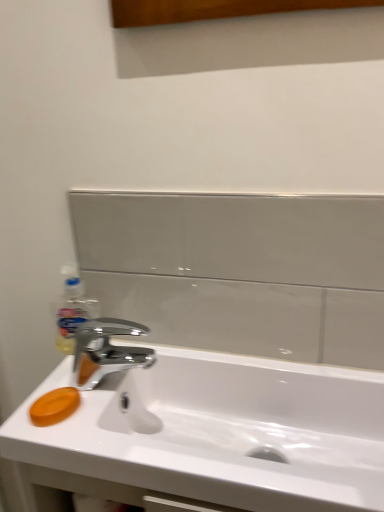
Question: From the image's perspective, does translucent plastic soap dispenser at left appear lower than chrome metallic faucet at center?

Choices:
 (A) yes
 (B) no

Answer: (B)

Question: Does translucent plastic soap dispenser at left appear on the right side of chrome metallic faucet at center?

Choices:
 (A) yes
 (B) no

Answer: (B)

Question: Considering the relative sizes of translucent plastic soap dispenser at left and chrome metallic faucet at center in the image provided, is translucent plastic soap dispenser at left bigger than chrome metallic faucet at center?

Choices:
 (A) yes
 (B) no

Answer: (B)

Question: Can you confirm if translucent plastic soap dispenser at left is thinner than chrome metallic faucet at center?

Choices:
 (A) no
 (B) yes

Answer: (B)

Question: Considering the relative sizes of translucent plastic soap dispenser at left and chrome metallic faucet at center in the image provided, is translucent plastic soap dispenser at left smaller than chrome metallic faucet at center?

Choices:
 (A) yes
 (B) no

Answer: (A)

Question: Is orange matte soap at lower left to the left or to the right of white glossy sink at center in the image?

Choices:
 (A) left
 (B) right

Answer: (A)

Question: Relative to white glossy sink at center, is orange matte soap at lower left in front or behind?

Choices:
 (A) behind
 (B) front

Answer: (A)

Question: From a real-world perspective, is orange matte soap at lower left above or below white glossy sink at center?

Choices:
 (A) below
 (B) above

Answer: (B)

Question: In terms of height, does orange matte soap at lower left look taller or shorter compared to white glossy sink at center?

Choices:
 (A) short
 (B) tall

Answer: (A)

Question: In terms of width, does white glossy sink at center look wider or thinner when compared to orange matte soap at lower left?

Choices:
 (A) thin
 (B) wide

Answer: (B)

Question: From the image's perspective, is white glossy sink at center located above or below orange matte soap at lower left?

Choices:
 (A) above
 (B) below

Answer: (B)

Question: Is point (178, 420) positioned closer to the camera than point (36, 418)?

Choices:
 (A) closer
 (B) farther

Answer: (B)

Question: From a real-world perspective, is white glossy sink at center physically located above or below orange matte soap at lower left?

Choices:
 (A) below
 (B) above

Answer: (A)

Question: Is orange matte soap at lower left taller or shorter than chrome metallic faucet at center?

Choices:
 (A) short
 (B) tall

Answer: (A)

Question: Is point (39, 412) closer or farther from the camera than point (84, 340)?

Choices:
 (A) closer
 (B) farther

Answer: (A)